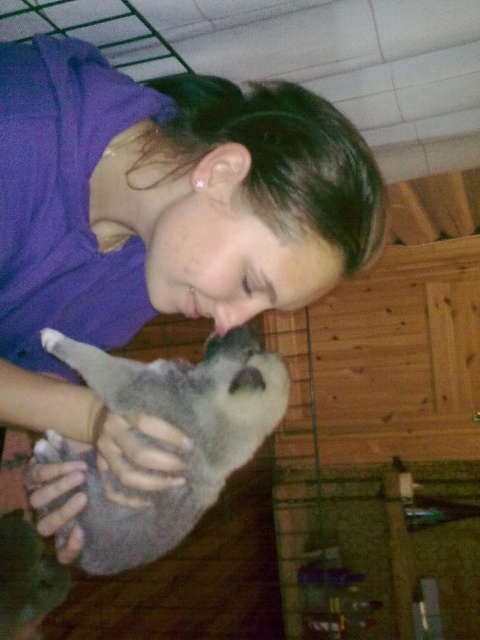
You are standing in the room and want to place a small gift for the kitten. There are two points marked in the image. The first point is at coordinate point (78, 58) and the second is at point (55, 342). Which point is closer to you, the observer?

Point (78, 58) is in front of point (55, 342), so it is closer to you as the observer.

You are an interior designer assessing the layout of a room. You notice the purple fabric at upper left and the fuzzy gray cat at center. Which object is located to the right of the other?

The purple fabric at upper left is positioned on the right side of fuzzy gray cat at center, so the purple fabric at upper left is to the right of the fuzzy gray cat at center.